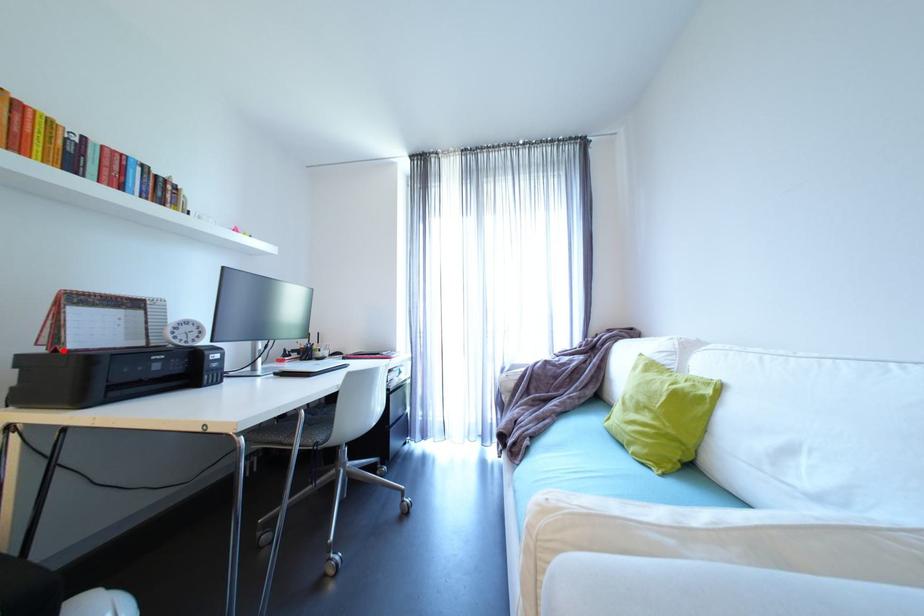
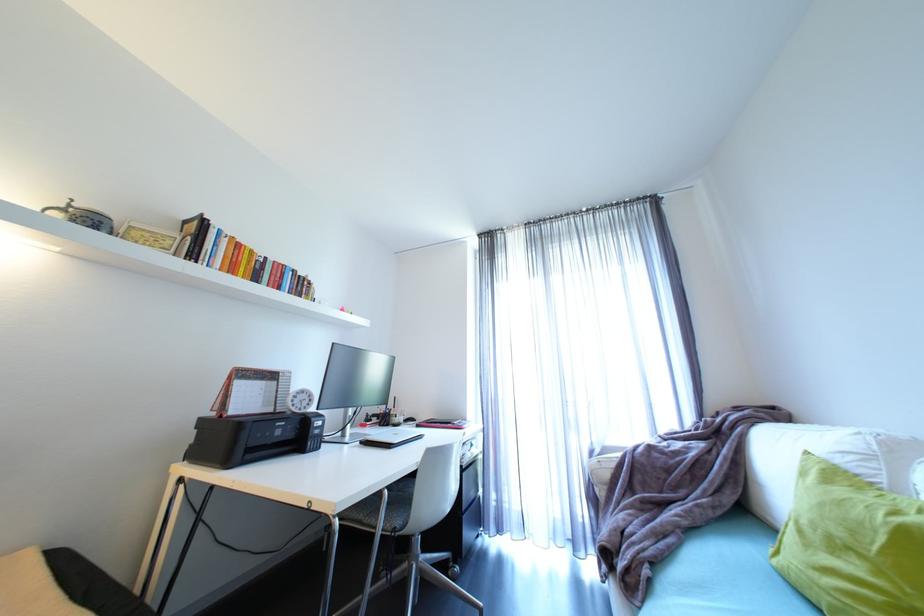
Locate, in the second image, the point that corresponds to the highlighted location in the first image.

(228, 416)